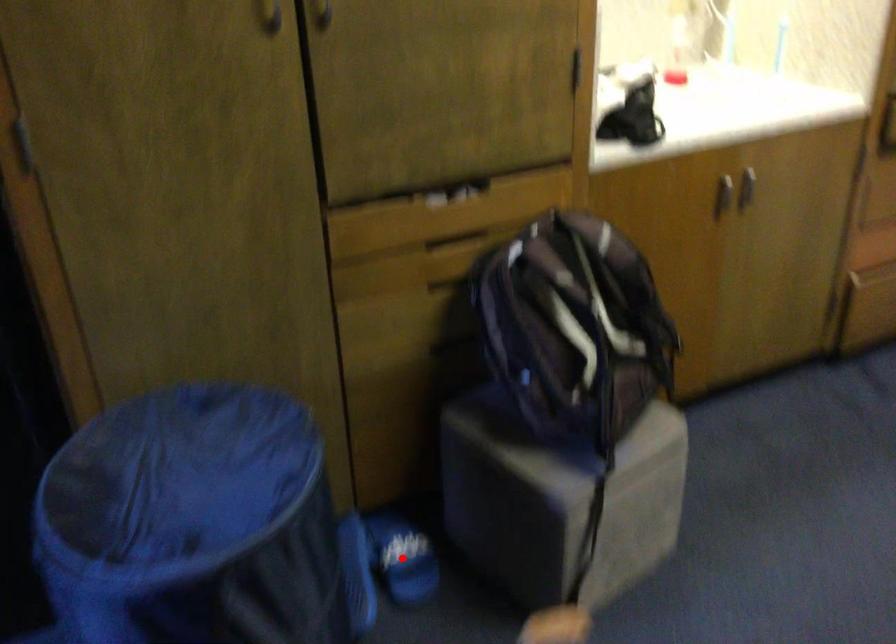
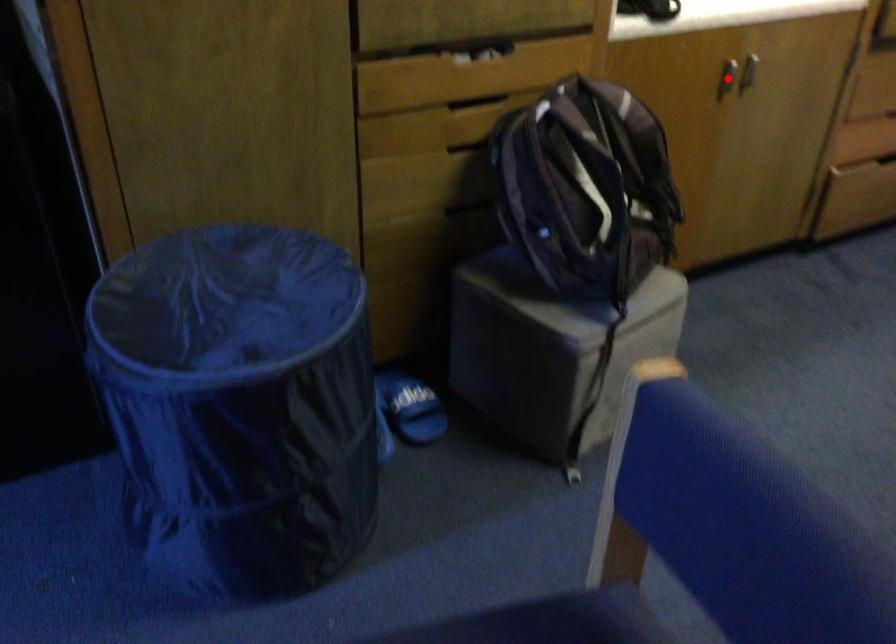
I am providing you with two images of the same scene from different viewpoints. A red point is marked on the first image and another point is marked on the second image. Are the points marked in image1 and image2 representing the same 3D position?

No